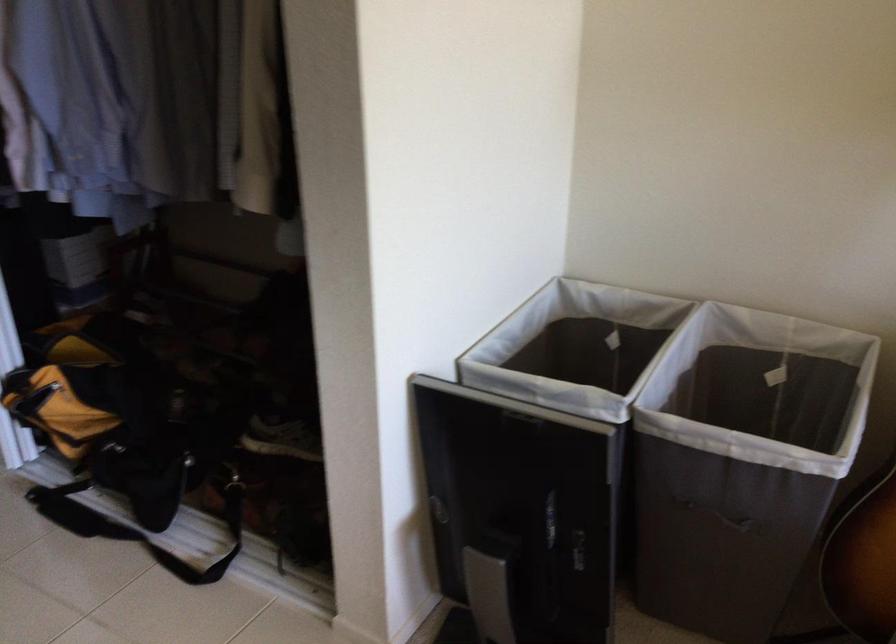
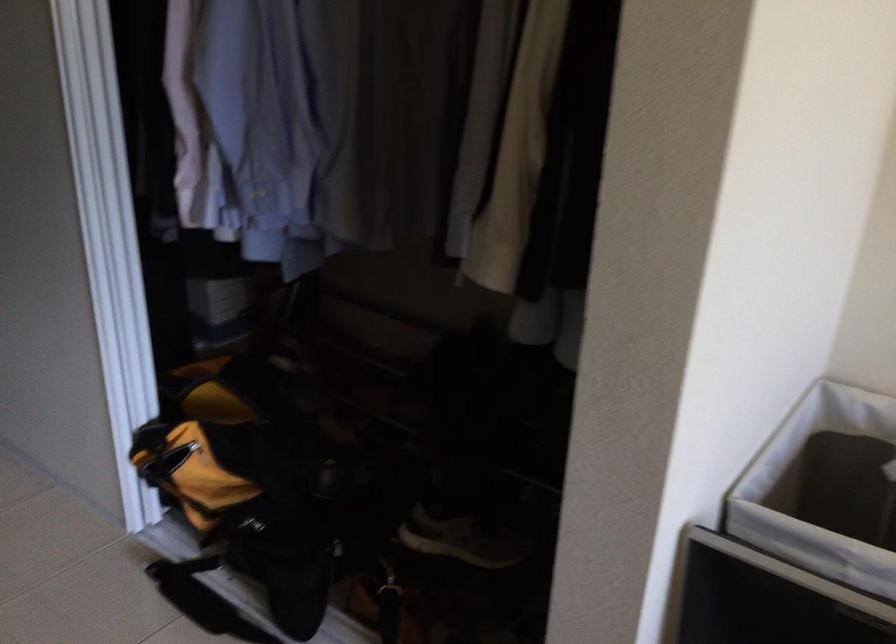
Which direction would the cameraman need to move to produce the second image?

The cameraman moved toward left, forward.